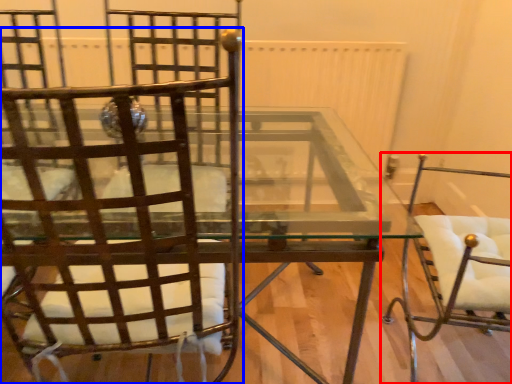
Question: Which object appears closest to the camera in this image, chair (highlighted by a red box) or chair (highlighted by a blue box)?

Choices:
 (A) chair
 (B) chair

Answer: (B)